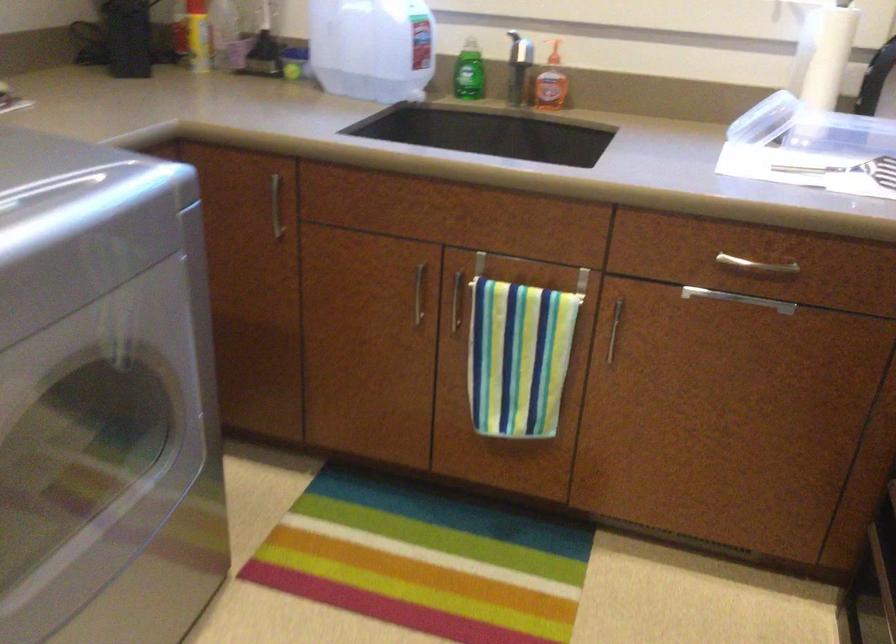
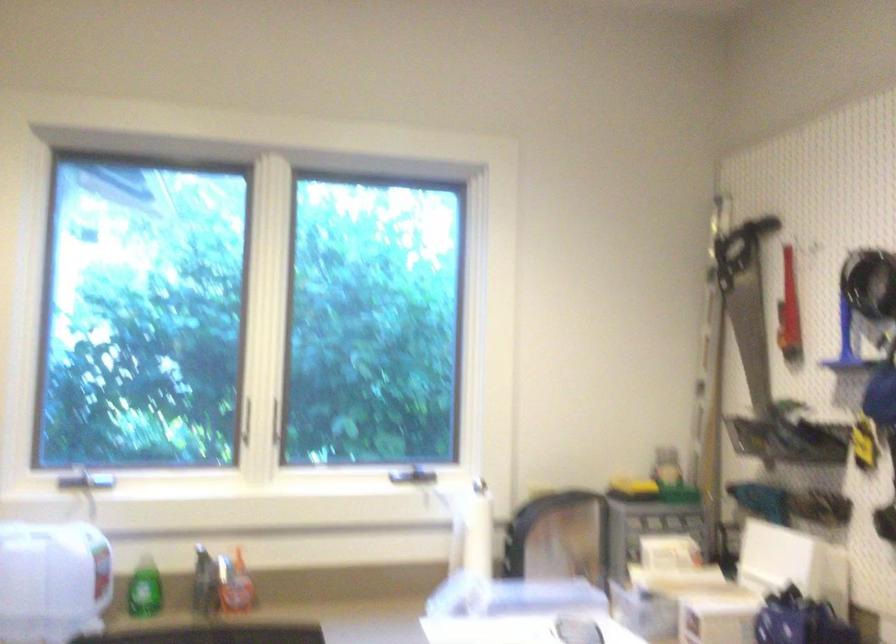
Find the pixel in the second image that matches pixel 466 73 in the first image.

(143, 589)